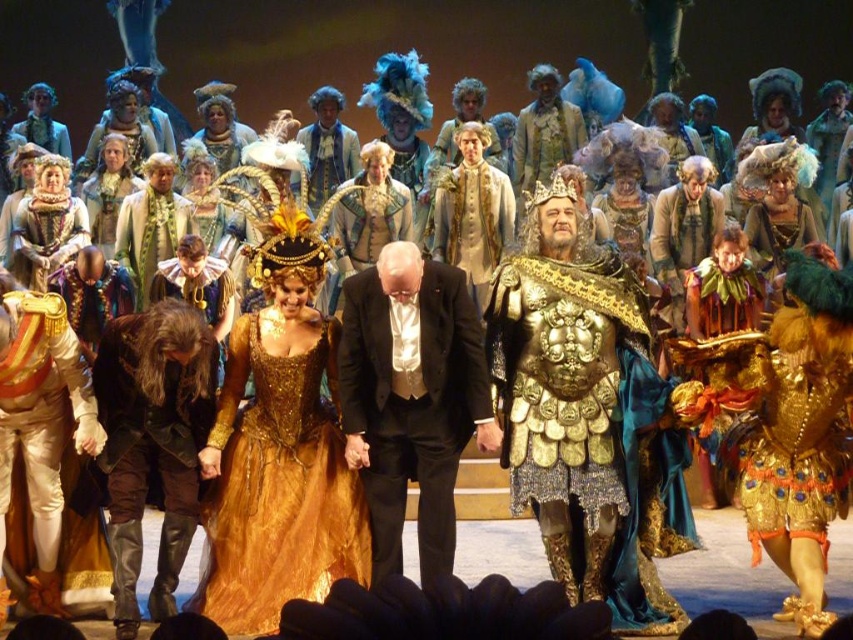
Question: Is gold sequined dress at center above leather black boots at lower left?

Choices:
 (A) yes
 (B) no

Answer: (B)

Question: Is gold metallic armor at center positioned behind black satin suit at center?

Choices:
 (A) no
 (B) yes

Answer: (B)

Question: Can you confirm if black satin suit at center is smaller than leather black boots at lower left?

Choices:
 (A) no
 (B) yes

Answer: (A)

Question: Which of the following is the farthest from the observer?

Choices:
 (A) (308, 584)
 (B) (166, 339)
 (C) (461, 333)

Answer: (C)

Question: Based on their relative distances, which object is farther from the gold sequined dress at center?

Choices:
 (A) leather black boots at lower left
 (B) gold metallic armor at center

Answer: (B)

Question: Among these objects, which one is farthest from the camera?

Choices:
 (A) gold metallic armor at center
 (B) gold sequined dress at center

Answer: (A)